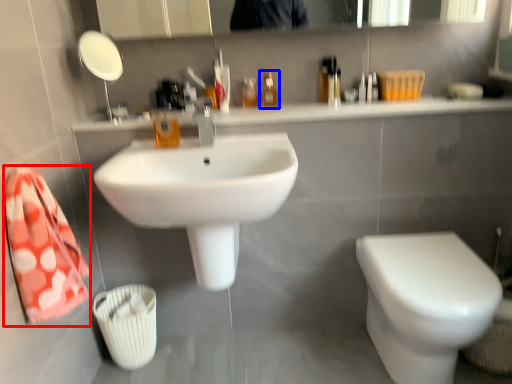
Question: Which point is further to the camera, bath towel (highlighted by a red box) or mouthwash (highlighted by a blue box)?

Choices:
 (A) bath towel
 (B) mouthwash

Answer: (B)